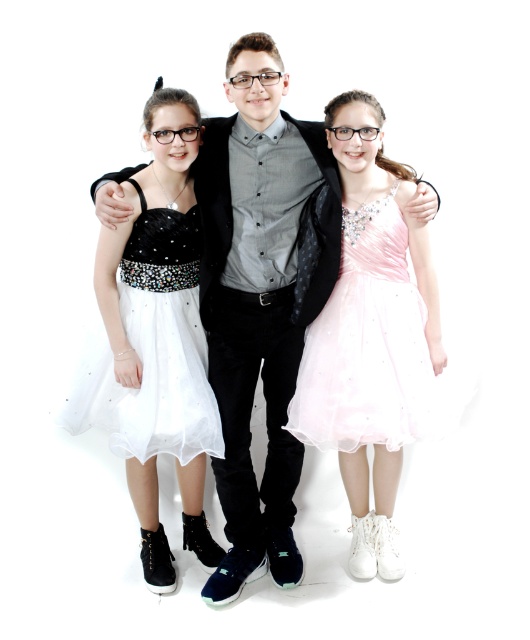
You are a photographer setting up a photo shoot for three people. The scene requires the two central figures, the matte black shirt at center and the pink satin dress at center, to be positioned exactly 10 inches apart. Based on the current setup, will you need to adjust their positions to meet this requirement?

The current distance between the matte black shirt at center and the pink satin dress at center is 8.13 inches, which is less than the required 10 inches. Therefore, you will need to adjust their positions to increase the distance between them to meet the requirement.

You are a photographer setting up a photo shoot with the three people in the scene. You need to decide which clothing item, the matte black shirt at center or the pink satin dress at center, should be highlighted in the lighting setup. Based on their sizes, which one requires more space in the frame?

The matte black shirt at center is larger in size than the pink satin dress at center, so it requires more space in the frame and should be highlighted in the lighting setup.

You are an observer looking at the image. Which dress is positioned lower between the pink satin dress at center and the white tulle dress at left?

The pink satin dress at center is located below the white tulle dress at left, so the pink satin dress at center is positioned lower.